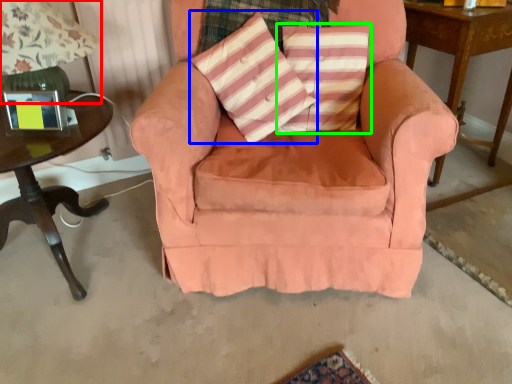
Question: Estimate the real-world distances between objects in this image. Which object is closer to table lamp (highlighted by a red box), throw pillow (highlighted by a blue box) or pillow (highlighted by a green box)?

Choices:
 (A) throw pillow
 (B) pillow

Answer: (A)